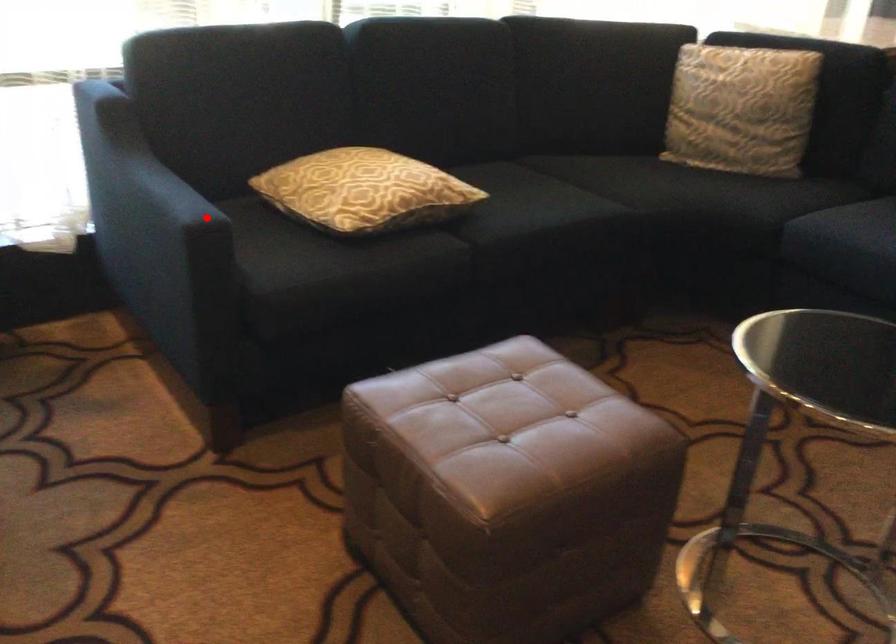
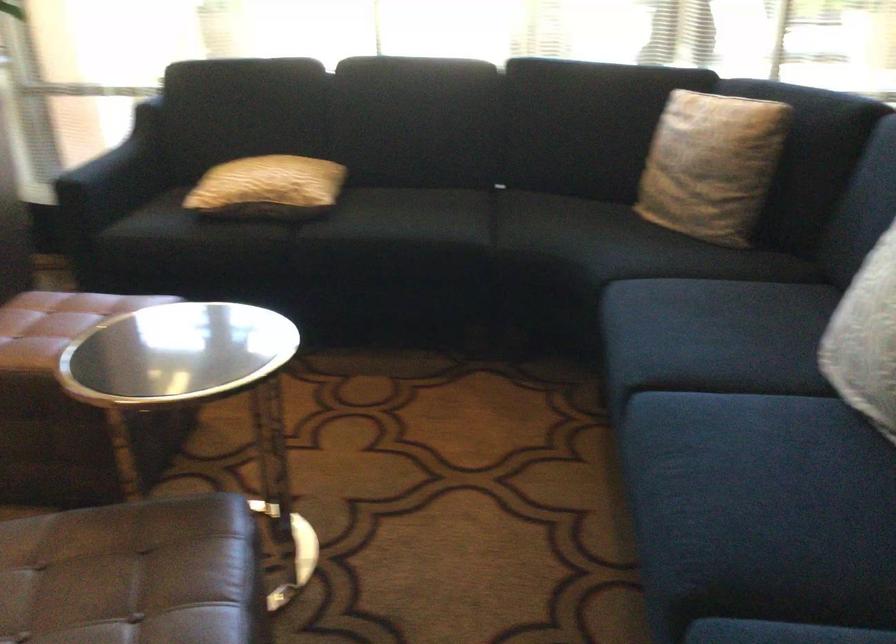
Question: I am providing you with two images of the same scene from different viewpoints. Given a red point in image1, look at the same physical point in image2. Is it:

Choices:
 (A) Closer to the viewpoint
 (B) Farther from the viewpoint

Answer: (B)